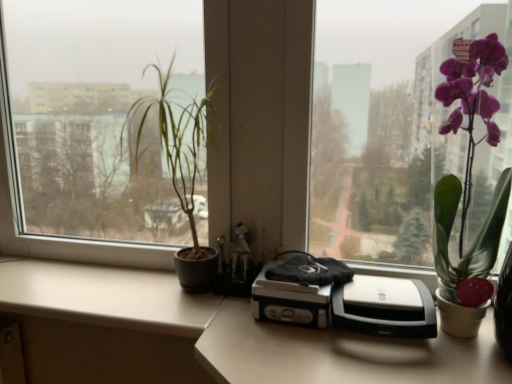
Identify the location of vacant space positioned to the left of green matte plant at left, positioned as the 1th houseplant in left-to-right order. Image resolution: width=512 pixels, height=384 pixels. (99, 292).